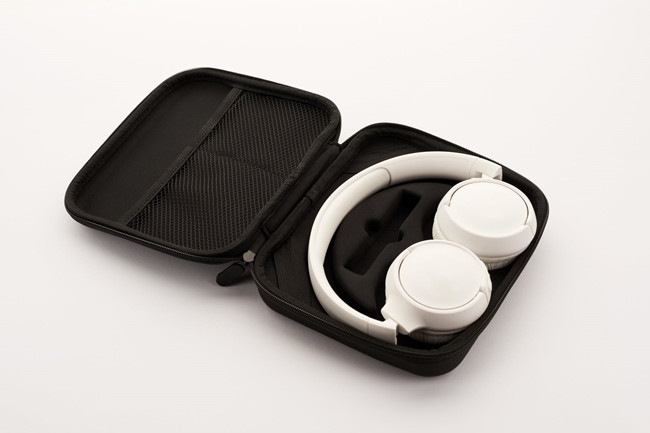
Identify the location of earphone speakers. (442, 280), (491, 218).